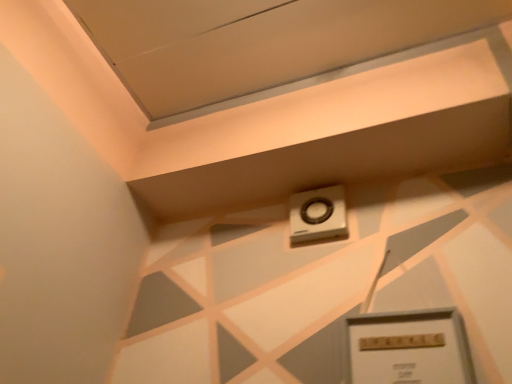
Question: Considering their positions, is metallic gray thermostat at upper center located in front of or behind white plastic alarm at upper center?

Choices:
 (A) behind
 (B) front

Answer: (B)

Question: From a real-world perspective, relative to white plastic alarm at upper center, is metallic gray thermostat at upper center vertically above or below?

Choices:
 (A) below
 (B) above

Answer: (A)

Question: Considering the relative positions of metallic gray thermostat at upper center and white plastic alarm at upper center in the image provided, is metallic gray thermostat at upper center to the left or to the right of white plastic alarm at upper center?

Choices:
 (A) right
 (B) left

Answer: (A)

Question: Is point coord(333,213) closer or farther from the camera than point coord(348,327)?

Choices:
 (A) farther
 (B) closer

Answer: (A)

Question: In terms of width, does white plastic alarm at upper center look wider or thinner when compared to metallic gray thermostat at upper center?

Choices:
 (A) wide
 (B) thin

Answer: (A)

Question: Relative to metallic gray thermostat at upper center, is white plastic alarm at upper center in front or behind?

Choices:
 (A) behind
 (B) front

Answer: (A)

Question: From a real-world perspective, relative to metallic gray thermostat at upper center, is white plastic alarm at upper center vertically above or below?

Choices:
 (A) above
 (B) below

Answer: (A)